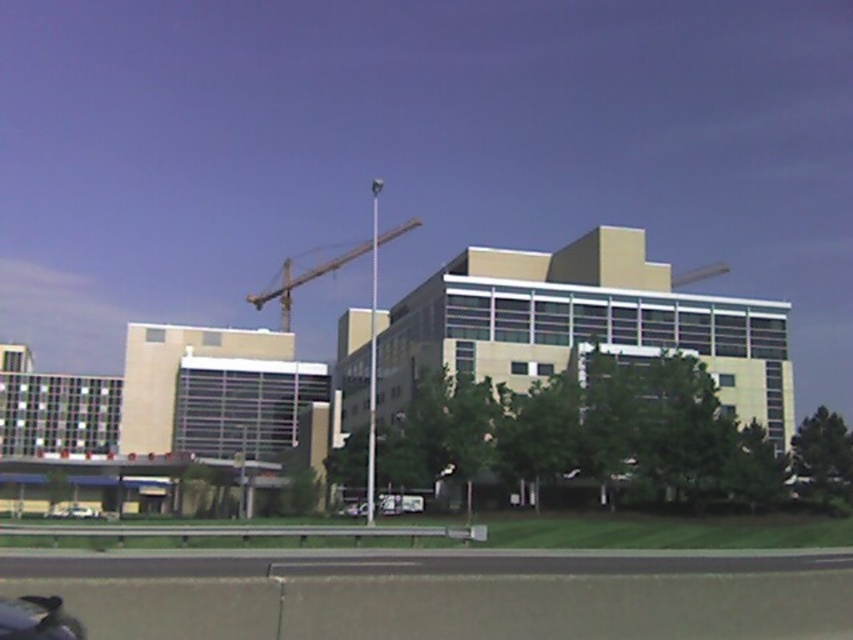
The image size is (853, 640). Identify the location of metallic gray crane at center. (318, 273).

Does metallic gray crane at center appear on the right side of white matte car at lower left?

No, metallic gray crane at center is not to the right of white matte car at lower left.

Who is more distant from viewer, (354,250) or (91,513)?

The point (354,250) is behind.

The image size is (853, 640). I want to click on metallic gray crane at center, so click(x=318, y=273).

Where is `black asphalt highway at lower center`? The image size is (853, 640). black asphalt highway at lower center is located at coordinates (402, 563).

Can you confirm if black asphalt highway at lower center is thinner than metallic gray crane at center?

Yes.

Who is more distant from viewer, (790, 561) or (380, 243)?

The point (380, 243) is more distant.

Where is `black asphalt highway at lower center`? black asphalt highway at lower center is located at coordinates (402, 563).

Which is behind, point (126, 577) or point (73, 504)?

Positioned behind is point (73, 504).

Which of these two, black asphalt highway at lower center or white matte car at lower left, stands shorter?

With less height is white matte car at lower left.

Where is `black asphalt highway at lower center`? The image size is (853, 640). black asphalt highway at lower center is located at coordinates (402, 563).